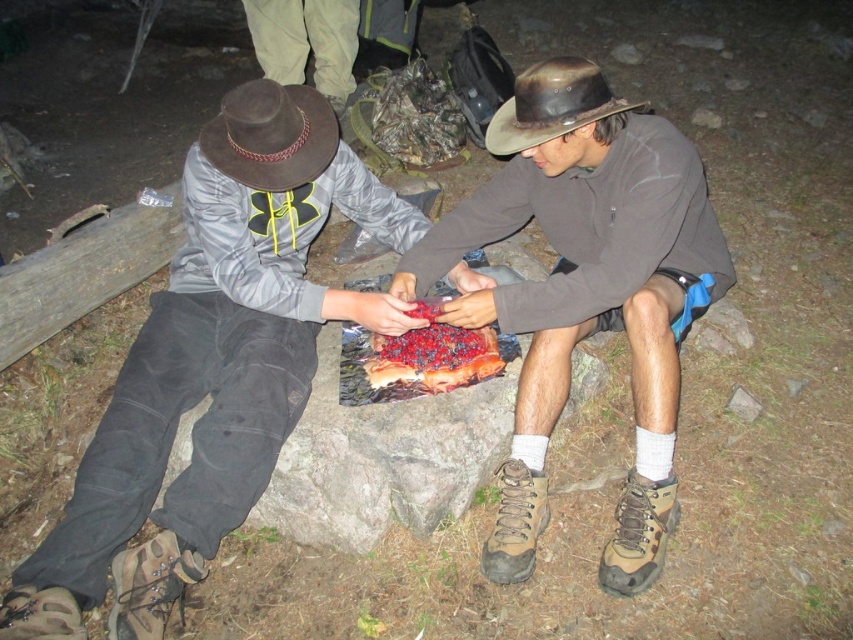
You are a photographer trying to capture a candid shot of the two campers. You want to ensure that both the matte gray jacket at center and the brown suede hiking boot at lower center are clearly visible in the frame. Given their relative sizes in the image, which object should you focus on first to ensure proper focus and composition?

The matte gray jacket at center is taller than the brown suede hiking boot at lower center, so focusing on the matte gray jacket at center first will ensure proper focus and composition since it is the larger object in the frame.